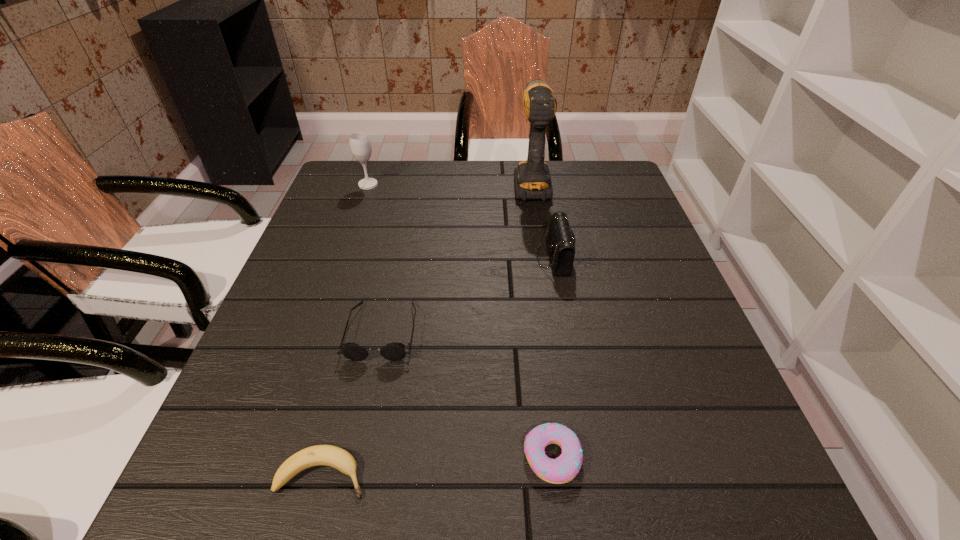
Locate an element on the screen. banana situated at the left edge is located at coordinates (327, 455).

Locate an element on the screen. The width and height of the screenshot is (960, 540). object positioned at the far left corner is located at coordinates (360, 145).

You are a GUI agent. You are given a task and a screenshot of the screen. Output one action in this format:
    pyautogui.click(x=<x>, y=<y>)
    Task: Click on the object at the near left corner
    This screenshot has width=960, height=540.
    Given the screenshot: What is the action you would take?
    pyautogui.click(x=327, y=455)

This screenshot has width=960, height=540. In the image, there is a desktop. What are the coordinates of `vacant space at the far edge` in the screenshot? It's located at (513, 187).

Find the location of a particular element. This screenshot has width=960, height=540. free space at the left edge is located at coordinates (353, 233).

Find the location of a particular element. This screenshot has width=960, height=540. vacant area at the right edge is located at coordinates (611, 240).

Identify the location of blank space at the far left corner. Image resolution: width=960 pixels, height=540 pixels. (375, 193).

Where is `vacant space at the far right corner of the desktop`? vacant space at the far right corner of the desktop is located at coordinates coord(572,179).

Locate an element on the screen. free region at the near right corner of the desktop is located at coordinates (682, 523).

I want to click on free space between the fourth shortest object and the sunglasses, so click(x=468, y=294).